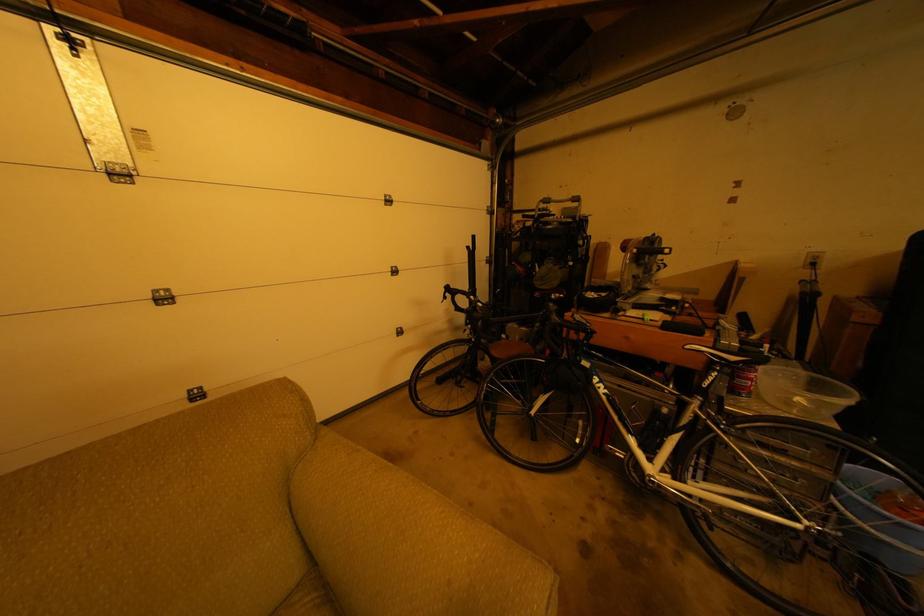
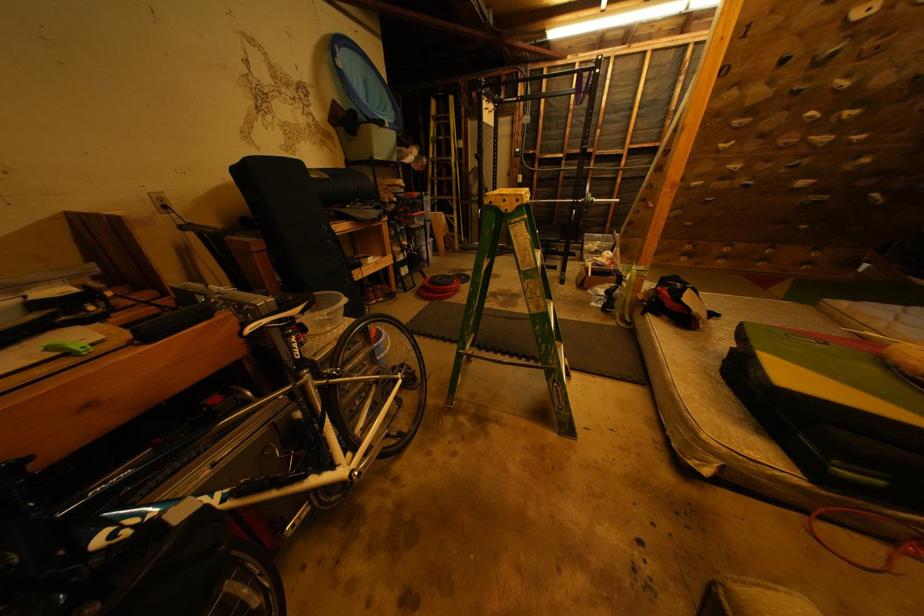
The images are taken continuously from a first-person perspective. In which direction is your viewpoint rotating?

The camera's rotation is toward right-down.